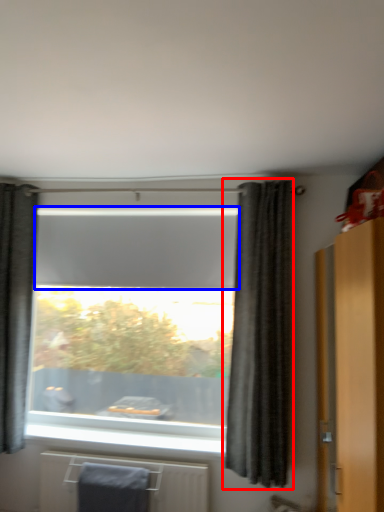
Question: Which of the following is the farthest to the observer, curtain (highlighted by a red box) or blind (highlighted by a blue box)?

Choices:
 (A) curtain
 (B) blind

Answer: (B)